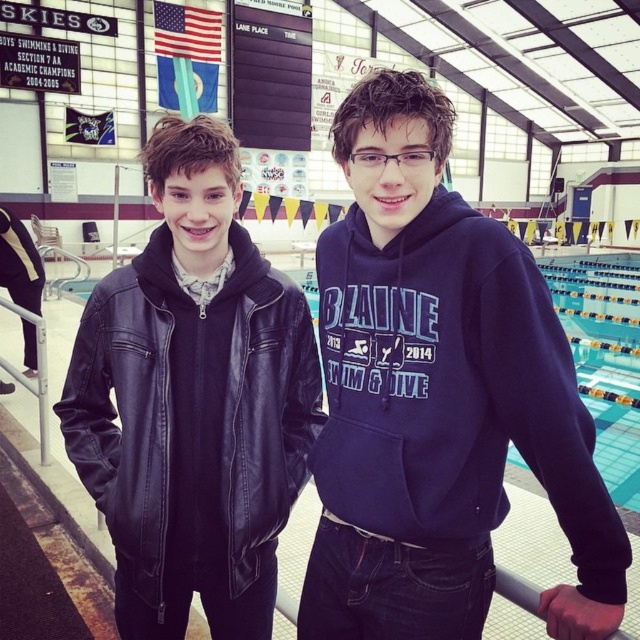
Between point (628, 419) and point (20, 380), which one is positioned in front?

Point (20, 380) is in front.

Does blue tile swimming pool at center have a greater height compared to white metallic rail at left?

Correct, blue tile swimming pool at center is much taller as white metallic rail at left.

Locate an element on the screen. Image resolution: width=640 pixels, height=640 pixels. blue tile swimming pool at center is located at coordinates (604, 355).

The image size is (640, 640). What are the coordinates of `blue tile swimming pool at center` in the screenshot? It's located at (604, 355).

Between leather jacket at left and white metallic rail at left, which one is positioned lower?

white metallic rail at left

Which is more to the left, leather jacket at left or white metallic rail at left?

white metallic rail at left is more to the left.

Identify the location of leather jacket at left. (180, 406).

This screenshot has width=640, height=640. I want to click on leather jacket at left, so click(x=180, y=406).

What do you see at coordinates (180, 406) in the screenshot? This screenshot has width=640, height=640. I see `leather jacket at left` at bounding box center [180, 406].

Does point (138, 360) lie behind point (573, 308)?

That is False.

Measure the distance between point (268, 524) and camera.

5.77 feet

This screenshot has height=640, width=640. I want to click on leather jacket at left, so click(180, 406).